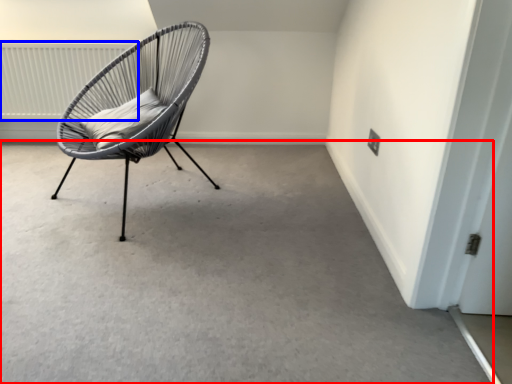
Question: Which object appears closest to the camera in this image, concrete (highlighted by a red box) or radiator (highlighted by a blue box)?

Choices:
 (A) concrete
 (B) radiator

Answer: (A)